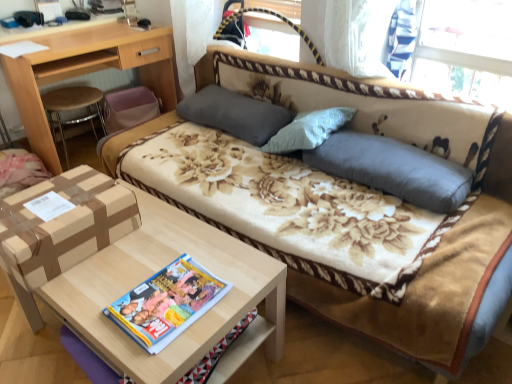
Identify the location of vacant area situated to the left side of multicolored glossy magazine at center. The height and width of the screenshot is (384, 512). (98, 290).